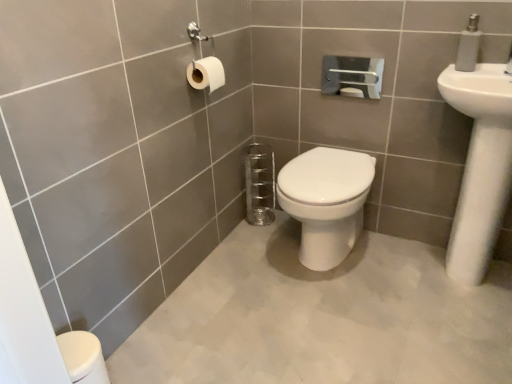
The height and width of the screenshot is (384, 512). In order to click on vacant area that lies between white glossy toilet at center and white glossy sink at upper right in this screenshot , I will do `click(395, 269)`.